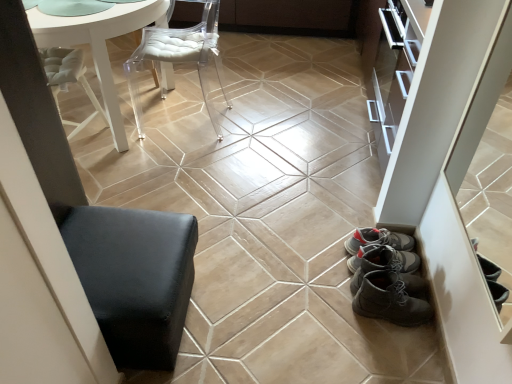
What are the coordinates of `free space to the back side of transparent acrylic chair at upper center` in the screenshot? It's located at (198, 91).